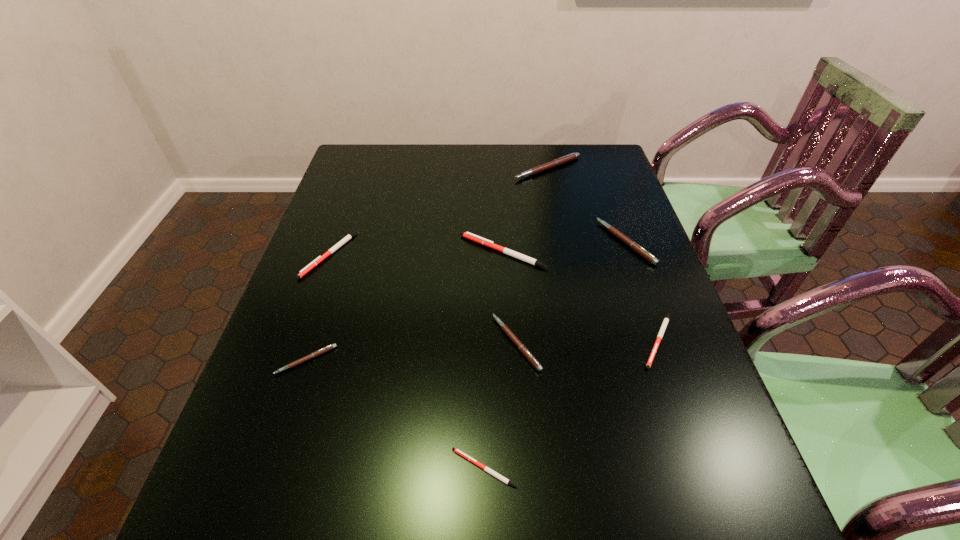
Identify the location of free space at the near edge of the desktop. The width and height of the screenshot is (960, 540). (318, 521).

I want to click on free region at the left edge, so click(x=234, y=476).

Find the location of a particular element. The width and height of the screenshot is (960, 540). vacant space at the right edge is located at coordinates (608, 187).

Locate an element on the screen. vacant space at the far left corner of the desktop is located at coordinates (354, 181).

Where is `free spot at the far right corner of the desktop`? The width and height of the screenshot is (960, 540). free spot at the far right corner of the desktop is located at coordinates (588, 179).

Where is `vacant area that lies between the farthest object and the second smallest pink pen`? vacant area that lies between the farthest object and the second smallest pink pen is located at coordinates pyautogui.click(x=532, y=256).

You are a GUI agent. You are given a task and a screenshot of the screen. Output one action in this format:
    pyautogui.click(x=<x>, y=<y>)
    Task: Click on the vacant space that's between the biggest white pen and the shortest pen
    The image size is (960, 540).
    Given the screenshot: What is the action you would take?
    pyautogui.click(x=493, y=360)

At what (x,y) coordinates should I click in order to perform the action: click on vacant area that lies between the third smallest white pen and the biggest white pen. Please return your answer as a coordinate pair (x, y). Image resolution: width=960 pixels, height=540 pixels. Looking at the image, I should click on (416, 253).

This screenshot has width=960, height=540. I want to click on empty space between the third biggest pink pen and the biggest pink pen, so click(x=532, y=256).

Find the location of `vacant area between the leftmost pink pen and the rightmost white pen`. vacant area between the leftmost pink pen and the rightmost white pen is located at coordinates (482, 350).